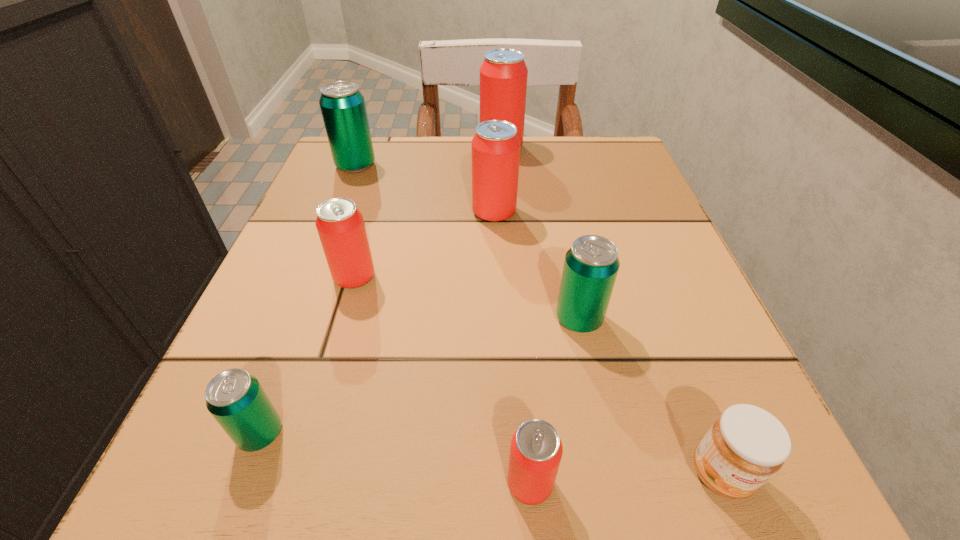
The image size is (960, 540). In order to click on vacant space located 0.050m on the left of the smallest teal beer can in this screenshot , I will do `click(195, 434)`.

You are a GUI agent. You are given a task and a screenshot of the screen. Output one action in this format:
    pyautogui.click(x=<x>, y=<y>)
    Task: Click on the free space located 0.290m on the left of the nearest red beer can
    The image size is (960, 540).
    Given the screenshot: What is the action you would take?
    pyautogui.click(x=234, y=483)

Find the location of a particular element. jam located at the near edge is located at coordinates (746, 445).

Find the location of a particular element. The image size is (960, 540). beer can that is positioned at the right edge is located at coordinates (591, 265).

The height and width of the screenshot is (540, 960). Find the location of `jam present at the right edge`. jam present at the right edge is located at coordinates (746, 445).

Where is `object that is positioned at the far left corner`? object that is positioned at the far left corner is located at coordinates (342, 105).

Locate an element on the screen. object that is at the near left corner is located at coordinates (235, 398).

Identify the location of object present at the near right corner. (746, 445).

The width and height of the screenshot is (960, 540). What are the coordinates of `free spot at the far edge of the desktop` in the screenshot? It's located at (539, 140).

This screenshot has width=960, height=540. Identify the location of vacant region at the left edge of the desktop. (301, 309).